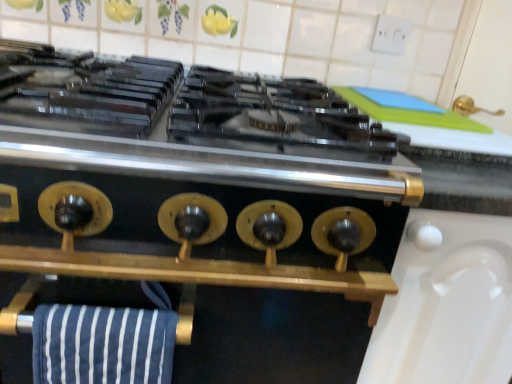
Question: Is blue striped towel at lower left oriented away from gold metallic stove knobs at center?

Choices:
 (A) yes
 (B) no

Answer: (A)

Question: Does blue striped towel at lower left have a greater width compared to gold metallic stove knobs at center?

Choices:
 (A) no
 (B) yes

Answer: (A)

Question: From a real-world perspective, is blue striped towel at lower left positioned under gold metallic stove knobs at center based on gravity?

Choices:
 (A) yes
 (B) no

Answer: (B)

Question: Is blue striped towel at lower left at the right side of gold metallic stove knobs at center?

Choices:
 (A) yes
 (B) no

Answer: (A)

Question: Is blue striped towel at lower left positioned far away from gold metallic stove knobs at center?

Choices:
 (A) yes
 (B) no

Answer: (B)

Question: Considering the relative sizes of blue striped towel at lower left and gold metallic stove knobs at center in the image provided, is blue striped towel at lower left shorter than gold metallic stove knobs at center?

Choices:
 (A) yes
 (B) no

Answer: (A)

Question: Considering the relative positions of gold metallic stove knobs at center and blue striped towel at lower left in the image provided, is gold metallic stove knobs at center behind blue striped towel at lower left?

Choices:
 (A) no
 (B) yes

Answer: (A)

Question: Is gold metallic stove knobs at center facing away from blue striped towel at lower left?

Choices:
 (A) yes
 (B) no

Answer: (B)

Question: Would you say blue striped towel at lower left is part of gold metallic stove knobs at center's contents?

Choices:
 (A) yes
 (B) no

Answer: (A)

Question: From the image's perspective, is gold metallic stove knobs at center on blue striped towel at lower left?

Choices:
 (A) no
 (B) yes

Answer: (A)

Question: Can you confirm if gold metallic stove knobs at center is positioned to the right of blue striped towel at lower left?

Choices:
 (A) no
 (B) yes

Answer: (A)

Question: Is gold metallic stove knobs at center positioned before blue striped towel at lower left?

Choices:
 (A) no
 (B) yes

Answer: (B)

Question: Considering the positions of blue striped towel at lower left and gold metallic stove knobs at center in the image, is blue striped towel at lower left wider or thinner than gold metallic stove knobs at center?

Choices:
 (A) wide
 (B) thin

Answer: (B)